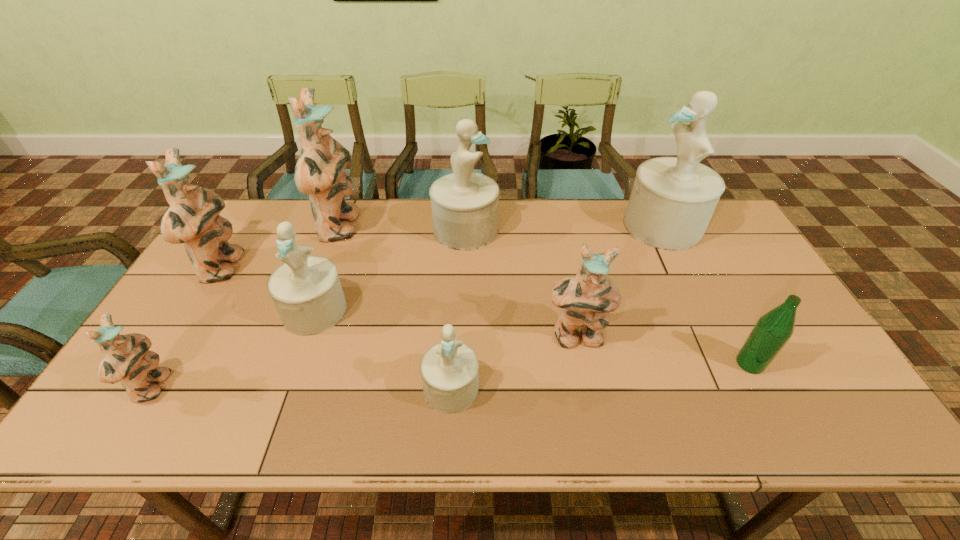
Where is `free spot located on the front of the bottle`? The width and height of the screenshot is (960, 540). free spot located on the front of the bottle is located at coordinates (785, 431).

Where is `vacant position located 0.330m on the front-facing side of the smallest pink figurine`? The image size is (960, 540). vacant position located 0.330m on the front-facing side of the smallest pink figurine is located at coordinates (x=309, y=388).

Locate an element on the screen. The image size is (960, 540). figurine located in the right edge section of the desktop is located at coordinates (672, 201).

I want to click on bottle located in the right edge section of the desktop, so click(x=772, y=331).

The height and width of the screenshot is (540, 960). Identify the location of object at the near left corner. (127, 359).

I want to click on object situated at the far right corner, so click(x=672, y=201).

Where is `free space at the far edge`? This screenshot has width=960, height=540. free space at the far edge is located at coordinates (596, 201).

In the image, there is a desktop. At what (x,y) coordinates should I click in order to perform the action: click on vacant space at the near edge. Please return your answer as a coordinate pair (x, y). Looking at the image, I should click on (421, 423).

Image resolution: width=960 pixels, height=540 pixels. In the image, there is a desktop. In order to click on vacant space at the left edge in this screenshot , I will do `click(169, 393)`.

The width and height of the screenshot is (960, 540). What are the coordinates of `vacant space that's between the biggest pink figurine and the rightmost white figurine` in the screenshot? It's located at (502, 227).